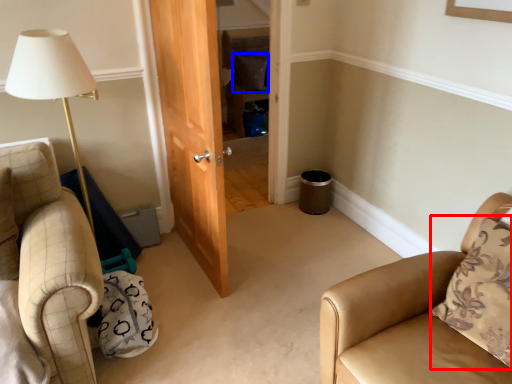
Question: Which object is closer to the camera taking this photo, pillow (highlighted by a red box) or pillow (highlighted by a blue box)?

Choices:
 (A) pillow
 (B) pillow

Answer: (A)